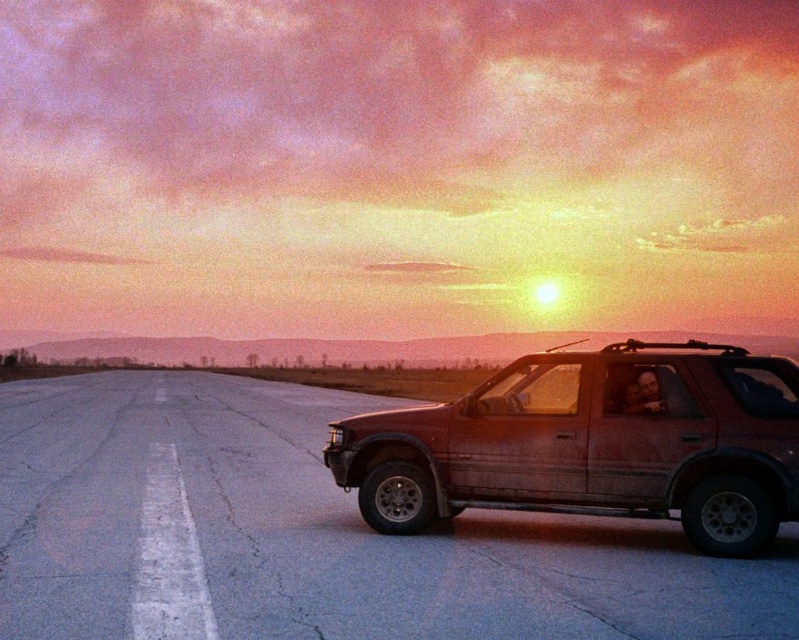
Question: Which object is closer to the camera taking this photo?

Choices:
 (A) matte red suv at right
 (B) smooth asphalt highway at center

Answer: (B)

Question: Does smooth asphalt highway at center appear on the left side of matte red suv at right?

Choices:
 (A) yes
 (B) no

Answer: (A)

Question: Considering the relative positions of smooth asphalt highway at center and matte red suv at right in the image provided, where is smooth asphalt highway at center located with respect to matte red suv at right?

Choices:
 (A) below
 (B) above

Answer: (A)

Question: Does smooth asphalt highway at center appear on the left side of matte red suv at right?

Choices:
 (A) no
 (B) yes

Answer: (B)

Question: Which object appears closest to the camera in this image?

Choices:
 (A) smooth asphalt highway at center
 (B) matte red suv at right

Answer: (A)